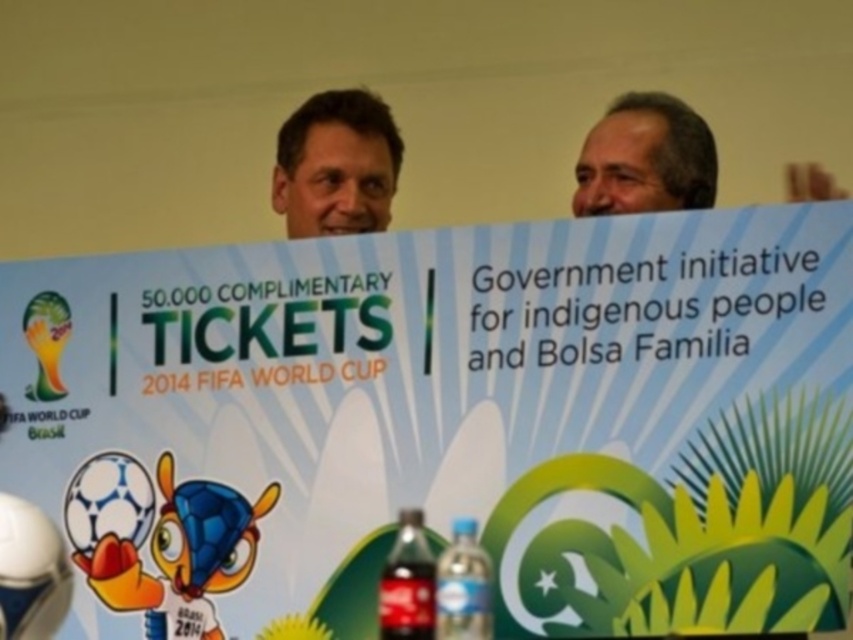
You are a photographer standing at a distance. You need to capture a clear photo of the white paper sign at center. What is the minimum distance you should stand from the sign to ensure it is in focus?

The white paper sign at center is 3.02 meters away from the camera. To ensure it is in focus, you should stand at least 3.02 meters away from the sign.

You are a photographer standing in front of the FIFA World Cup banner. You notice the matte blue shirt at upper center and the blue plastic bottle at lower center. Which object is closer to you?

The matte blue shirt at upper center is closer to you because it is further to the viewer than the blue plastic bottle at lower center.